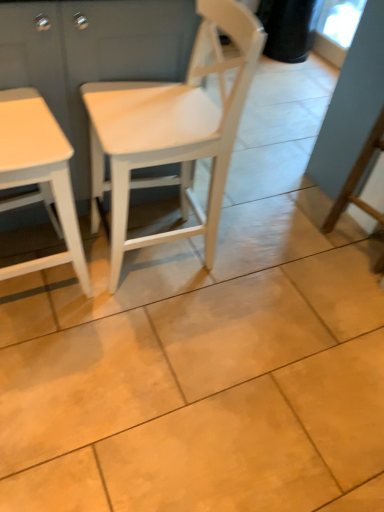
Question: From a real-world perspective, does white wood dresser at left stand above white matte wood chair at center?

Choices:
 (A) no
 (B) yes

Answer: (A)

Question: Is white wood dresser at left outside white matte wood chair at center?

Choices:
 (A) no
 (B) yes

Answer: (B)

Question: Can you confirm if white wood dresser at left is thinner than white matte wood chair at center?

Choices:
 (A) yes
 (B) no

Answer: (B)

Question: Is white matte wood chair at center located within white wood dresser at left?

Choices:
 (A) yes
 (B) no

Answer: (B)

Question: Considering the relative positions of white wood dresser at left and white matte wood chair at center in the image provided, is white wood dresser at left in front of white matte wood chair at center?

Choices:
 (A) yes
 (B) no

Answer: (B)

Question: From a real-world perspective, is white wood dresser at left positioned above or below white matte table at left?

Choices:
 (A) below
 (B) above

Answer: (A)

Question: Is white wood dresser at left bigger or smaller than white matte table at left?

Choices:
 (A) big
 (B) small

Answer: (A)

Question: In terms of width, does white wood dresser at left look wider or thinner when compared to white matte table at left?

Choices:
 (A) thin
 (B) wide

Answer: (B)

Question: Is white wood dresser at left taller or shorter than white matte table at left?

Choices:
 (A) short
 (B) tall

Answer: (A)

Question: Is white wood dresser at left spatially inside white matte wood chair at center, or outside of it?

Choices:
 (A) outside
 (B) inside

Answer: (A)

Question: Relative to white matte wood chair at center, is white wood dresser at left in front or behind?

Choices:
 (A) front
 (B) behind

Answer: (B)

Question: Looking at the image, does white wood dresser at left seem bigger or smaller compared to white matte wood chair at center?

Choices:
 (A) small
 (B) big

Answer: (B)

Question: From their relative heights in the image, would you say white wood dresser at left is taller or shorter than white matte wood chair at center?

Choices:
 (A) tall
 (B) short

Answer: (B)

Question: Which is correct: white matte wood chair at center is inside white matte table at left, or outside of it?

Choices:
 (A) inside
 (B) outside

Answer: (B)

Question: From the image's perspective, is white matte wood chair at center above or below white matte table at left?

Choices:
 (A) above
 (B) below

Answer: (A)